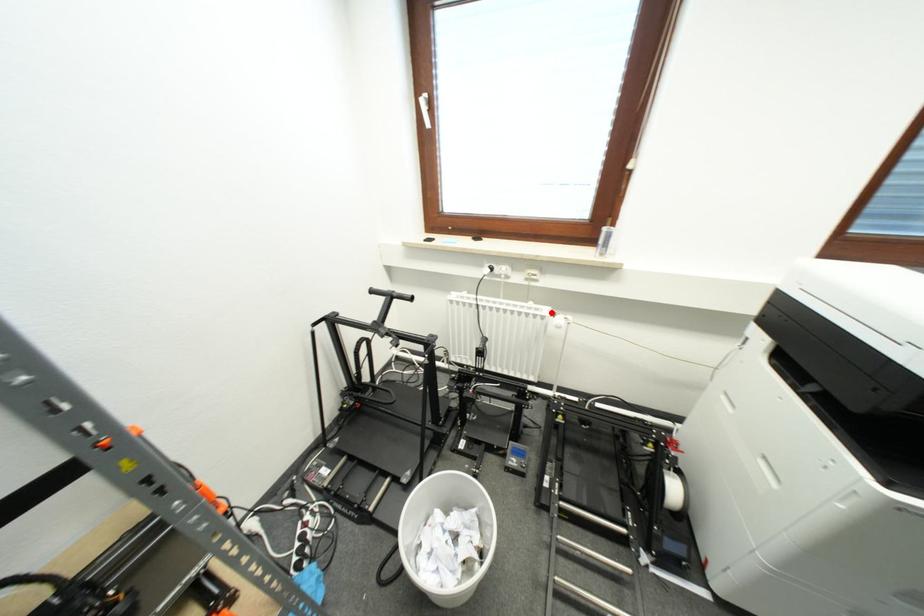
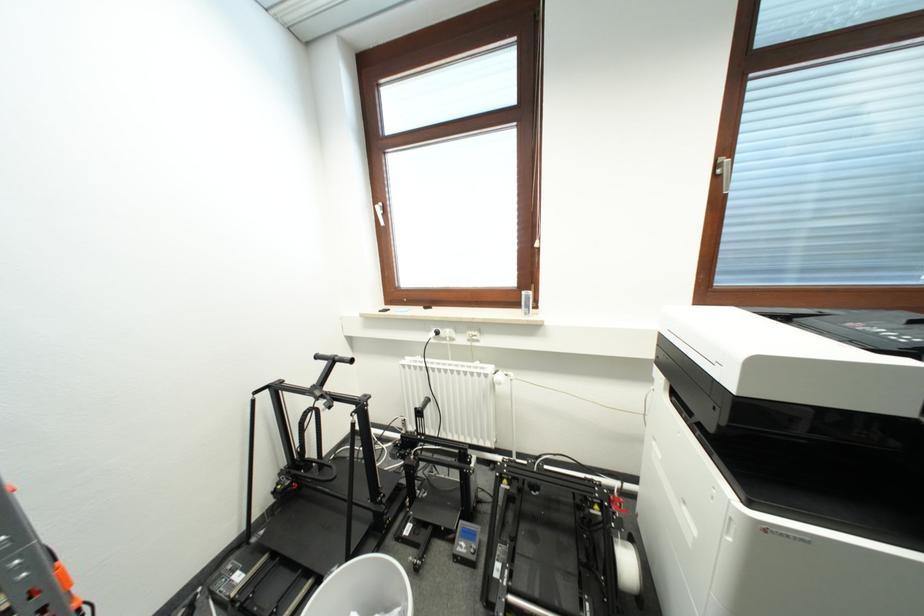
The point at the highlighted location is marked in the first image. Where is the corresponding point in the second image?

(494, 371)